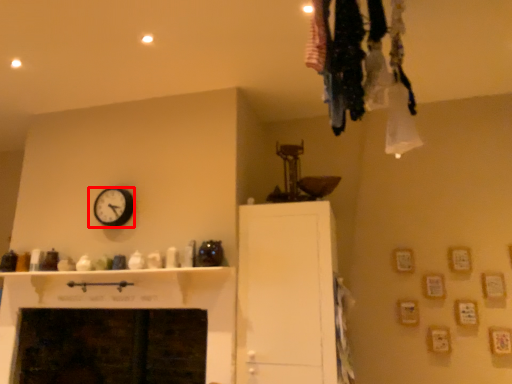
Question: Observing the image, what is the correct spatial positioning of wall clock (annotated by the red box) in reference to cabinetry?

Choices:
 (A) right
 (B) left

Answer: (B)